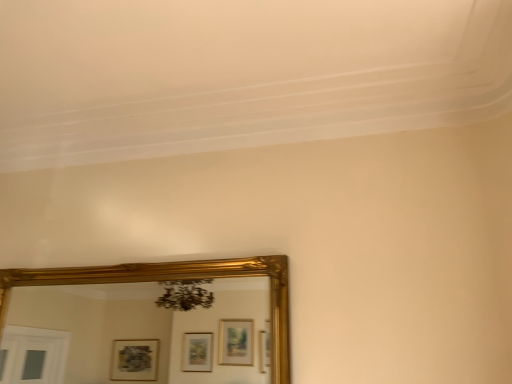
The width and height of the screenshot is (512, 384). What do you see at coordinates (140, 325) in the screenshot?
I see `gold-framed mirror at center` at bounding box center [140, 325].

Where is `gold-framed mirror at center`? This screenshot has width=512, height=384. gold-framed mirror at center is located at coordinates (140, 325).

I want to click on gold-framed mirror at center, so click(140, 325).